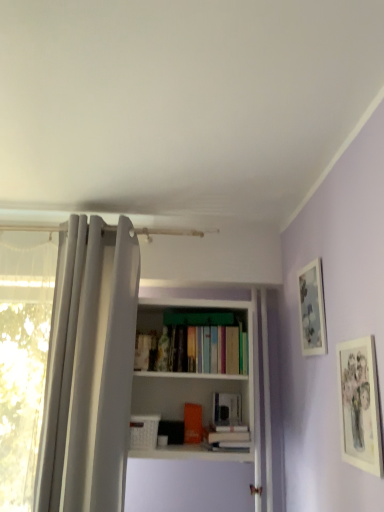
Find the location of a particular element. Image resolution: width=384 pixels, height=512 pixels. blank space above white fabric shower curtain at left (from a real-world perspective) is located at coordinates (107, 209).